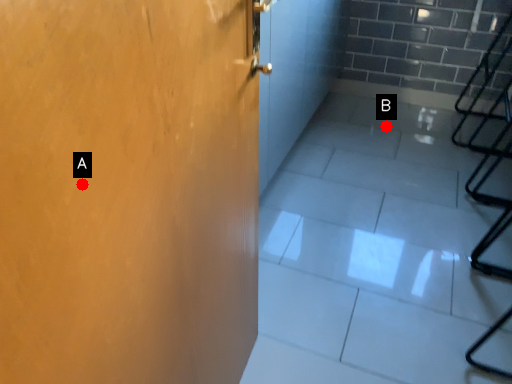
Question: Two points are circled on the image, labeled by A and B beside each circle. Which point appears closest to the camera in this image?

Choices:
 (A) A is closer
 (B) B is closer

Answer: (A)